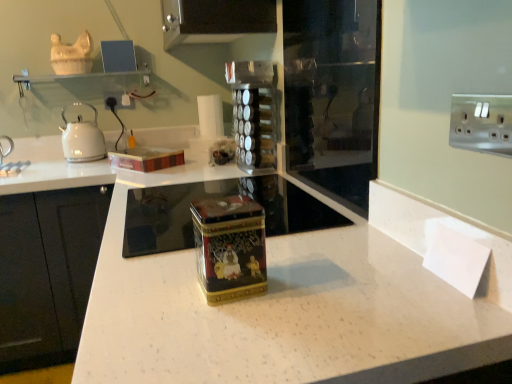
I want to click on gold metallic tin at center, so click(229, 247).

Find the location of a particular element. This screenshot has width=512, height=384. white speckled granite at center is located at coordinates (270, 295).

In the scene shown: What is the approximate width of white glossy kettle at left?

white glossy kettle at left is 8.69 inches in width.

This screenshot has width=512, height=384. Describe the element at coordinates (82, 138) in the screenshot. I see `white glossy kettle at left` at that location.

You are a GUI agent. You are given a task and a screenshot of the screen. Output one action in this format:
    pyautogui.click(x=<x>, y=<y>)
    Task: Click on the wooden box at upper center
    The width and height of the screenshot is (512, 384).
    Given the screenshot: What is the action you would take?
    pyautogui.click(x=146, y=158)

This screenshot has width=512, height=384. What are the coordinates of `clear plastic spice rack at center` in the screenshot? It's located at (254, 113).

Considering the sizes of objects white plastic electric outlet at upper right and gold metallic tin at center in the image provided, who is thinner, white plastic electric outlet at upper right or gold metallic tin at center?

white plastic electric outlet at upper right is thinner.

Between white plastic electric outlet at upper right and gold metallic tin at center, which one is positioned behind?

white plastic electric outlet at upper right is more distant.

Between white plastic electric outlet at upper right and gold metallic tin at center, which one has less height?

white plastic electric outlet at upper right is shorter.

From the picture: Is white speckled granite at center positioned with its back to white plastic electric outlet at upper right?

That's not correct — white speckled granite at center is not looking away from white plastic electric outlet at upper right.

From a real-world perspective, which object stands above the other?

In real-world perspective, white plastic electric outlet at upper right is above.

Is the depth of white speckled granite at center greater than that of white plastic electric outlet at upper right?

No, white speckled granite at center is closer to the viewer.

Considering the relative positions of white speckled granite at center and white plastic electric outlet at upper right in the image provided, is white speckled granite at center to the left or to the right of white plastic electric outlet at upper right?

Clearly, white speckled granite at center is on the right of white plastic electric outlet at upper right in the image.

From a real-world perspective, is white plastic electric outlet at upper right over clear glass shelf at upper center?

No, from a real-world perspective, white plastic electric outlet at upper right is not over clear glass shelf at upper center

Is white plastic electric outlet at upper right far from clear glass shelf at upper center?

No, white plastic electric outlet at upper right is in close proximity to clear glass shelf at upper center.

Which object is more forward, white plastic electric outlet at upper right or clear glass shelf at upper center?

Positioned in front is clear glass shelf at upper center.

Which object is closer to the camera, clear plastic spice rack at center or white plastic electric outlet at upper right?

clear plastic spice rack at center is closer to the camera.

Is clear plastic spice rack at center located outside white plastic electric outlet at upper right?

Absolutely, clear plastic spice rack at center is external to white plastic electric outlet at upper right.

Which of these two, clear plastic spice rack at center or white plastic electric outlet at upper right, is thinner?

Thinner between the two is white plastic electric outlet at upper right.

Would you consider clear plastic spice rack at center to be distant from white plastic electric outlet at upper right?

No, clear plastic spice rack at center is in close proximity to white plastic electric outlet at upper right.

Is wooden box at upper center aimed at white speckled granite at center?

No, wooden box at upper center does not turn towards white speckled granite at center.

Is wooden box at upper center surrounding white speckled granite at center?

No, white speckled granite at center is not inside wooden box at upper center.

Is point (118, 160) more distant than point (338, 314)?

Yes, point (118, 160) is farther from viewer.

Which object is positioned more to the left, wooden box at upper center or white speckled granite at center?

wooden box at upper center.

From the image's perspective, which object appears higher, transparent glass door at center or wooden box at upper center?

From the image's view, transparent glass door at center is above.

Where is `glass door in front of the wooden box at upper center`? The image size is (512, 384). glass door in front of the wooden box at upper center is located at coordinates (333, 95).

From a real-world perspective, is transparent glass door at center under wooden box at upper center?

No, from a real-world perspective, transparent glass door at center is not beneath wooden box at upper center.

Which point is more forward, (323,19) or (169,151)?

Positioned in front is point (323,19).

In terms of height, does wooden box at upper center look taller or shorter compared to transparent glass door at center?

Clearly, wooden box at upper center is shorter compared to transparent glass door at center.

How different are the orientations of wooden box at upper center and transparent glass door at center in degrees?

The angle between the facing direction of wooden box at upper center and the facing direction of transparent glass door at center is 33.8 degrees.

In terms of width, does wooden box at upper center look wider or thinner when compared to transparent glass door at center?

In the image, wooden box at upper center appears to be wider than transparent glass door at center.

Would you say transparent glass door at center is part of wooden box at upper center's contents?

That's incorrect, transparent glass door at center is not inside wooden box at upper center.

The height and width of the screenshot is (384, 512). In order to click on electric outlet located on the left of gold metallic tin at center in this screenshot , I will do `click(119, 100)`.

Find the location of a particular element. Image resolution: width=512 pixels, height=384 pixels. electric outlet above the white speckled granite at center (from the image's perspective) is located at coordinates (119, 100).

From the image, which object appears to be nearer to clear plastic spice rack at center, gold metallic tin at center or white plastic electric outlet at upper right?

Among the two, gold metallic tin at center is located nearer to clear plastic spice rack at center.

Considering their positions, is white glossy kettle at left positioned closer to white plastic electric outlet at upper right than gold metallic tin at center?

white glossy kettle at left is closer to white plastic electric outlet at upper right.

Considering their positions, is gold metallic tin at center positioned closer to clear plastic spice rack at center than clear glass shelf at upper center?

Among the two, gold metallic tin at center is located nearer to clear plastic spice rack at center.

Looking at the image, which one is located closer to white speckled granite at center, white plastic electric outlet at upper right or clear glass shelf at upper center?

clear glass shelf at upper center.

Estimate the real-world distances between objects in this image. Which object is closer to white speckled granite at center, gold metallic tin at center or wooden box at upper center?

gold metallic tin at center.

Which object lies nearer to the anchor point clear glass shelf at upper center, clear plastic spice rack at center or white plastic electric outlet at upper right?

white plastic electric outlet at upper right is closer to clear glass shelf at upper center.

Consider the image. When comparing their distances from clear glass shelf at upper center, does white plastic electric outlet at upper right or gold metallic tin at center seem closer?

white plastic electric outlet at upper right is closer to clear glass shelf at upper center.

From the image, which object appears to be nearer to wooden box at upper center, white speckled granite at center or clear plastic spice rack at center?

clear plastic spice rack at center lies closer to wooden box at upper center than the other object.

This screenshot has height=384, width=512. I want to click on shelf located between white speckled granite at center and white plastic electric outlet at upper right in the depth direction, so click(x=80, y=76).

The image size is (512, 384). I want to click on shelf positioned between wooden box at upper center and white plastic electric outlet at upper right from near to far, so click(x=80, y=76).

The width and height of the screenshot is (512, 384). In order to click on appliance between white speckled granite at center and wooden box at upper center in the front-back direction in this screenshot , I will do `click(229, 247)`.

The image size is (512, 384). In order to click on box located between transparent glass door at center and white glossy kettle at left in the depth direction in this screenshot , I will do `click(146, 158)`.